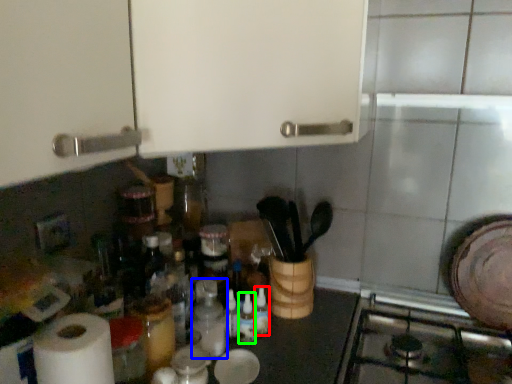
Question: Which object is positioned closest to bottle (highlighted by a red box)? Select from bottle (highlighted by a blue box) and bottle (highlighted by a green box).

Choices:
 (A) bottle
 (B) bottle

Answer: (B)